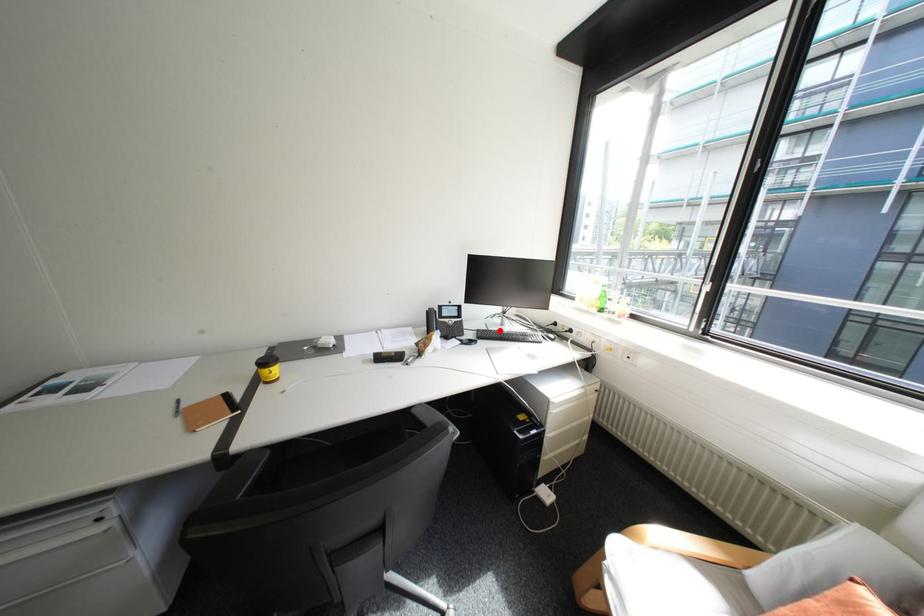
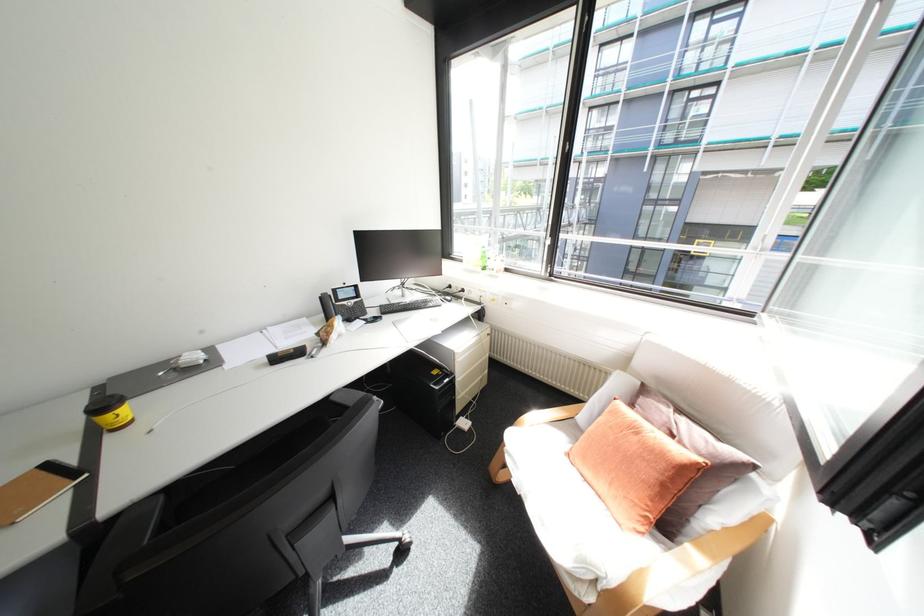
In the second image, find the point that corresponds to the highlighted location in the first image.

(403, 304)